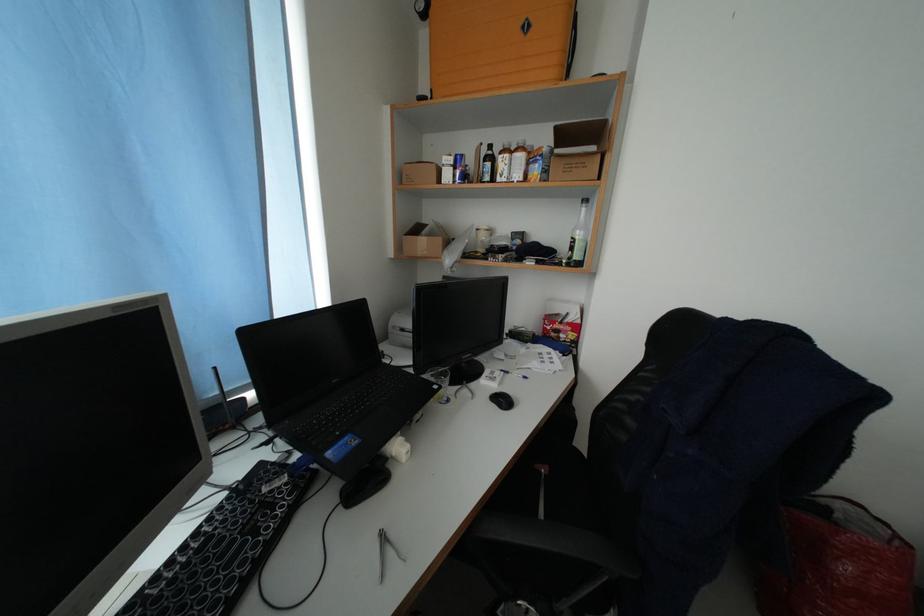
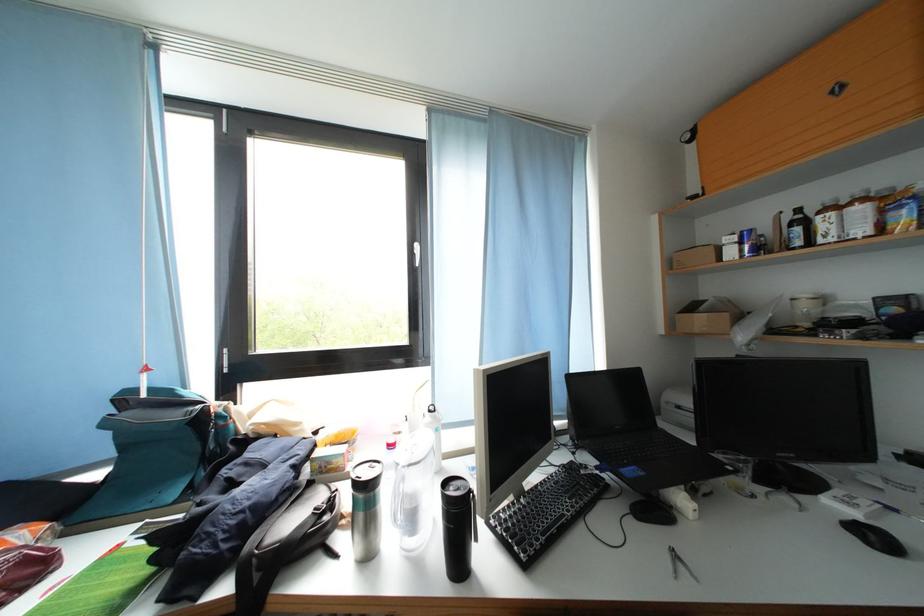
Find the pixel in the second image that matches point 508,411 in the first image.

(877, 548)